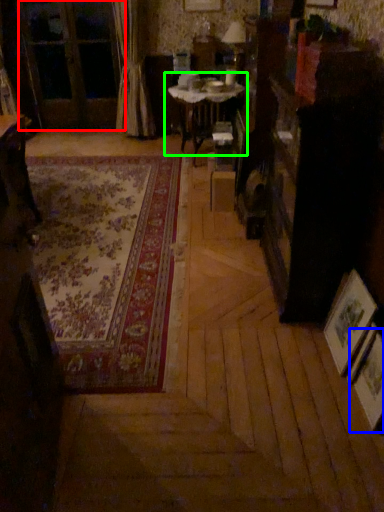
Question: Which object is the farthest from screen door (highlighted by a red box)? Choose among these: picture frame (highlighted by a blue box) or table (highlighted by a green box).

Choices:
 (A) picture frame
 (B) table

Answer: (A)